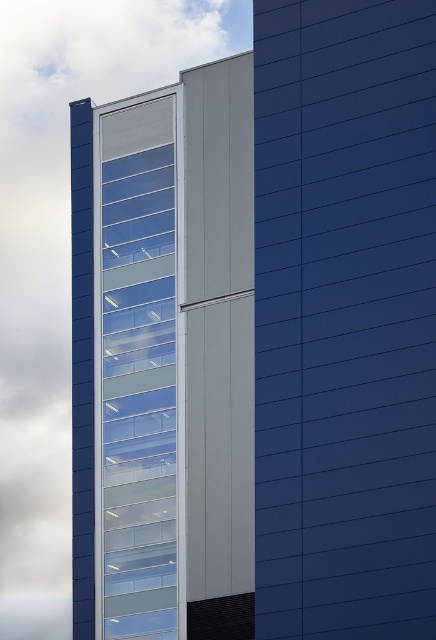
You are an architect analyzing the building layout. Based on the image, can you determine if the transparent glass building at center is wider than the transparent glass windows at upper left?

The transparent glass building at center might be wider than transparent glass windows at upper left according to the description.

You are standing in front of the modern building and want to know if the transparent glass building at center is positioned higher than the transparent glass windows at upper left. Based on the scene, can you determine this?

The transparent glass building at center is above transparent glass windows at upper left, so yes, it is positioned higher.